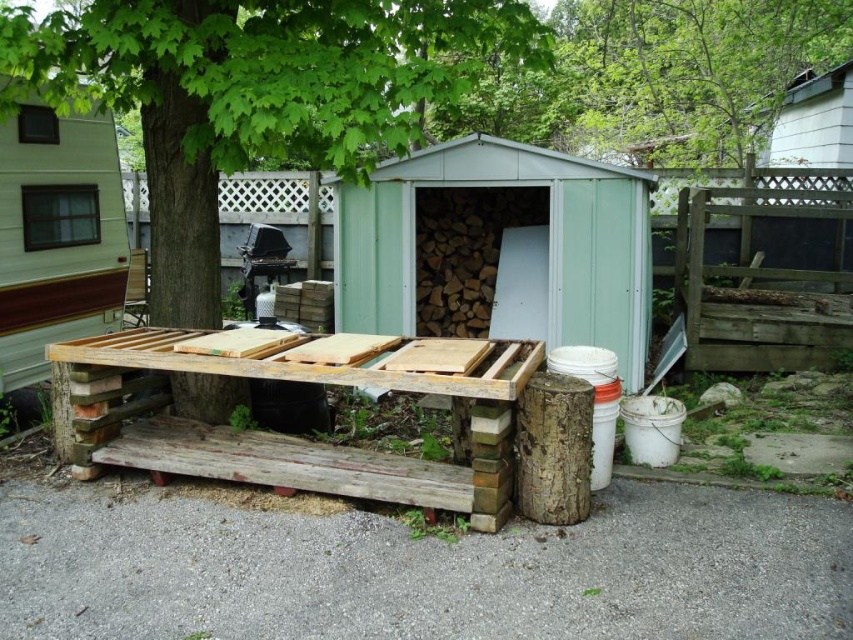
Question: Can you confirm if green leafy tree at center is positioned above weathered wood picnic table at lower left?

Choices:
 (A) no
 (B) yes

Answer: (B)

Question: Is green leafy tree at center further to the viewer compared to green leafy tree at upper center?

Choices:
 (A) no
 (B) yes

Answer: (A)

Question: Observing the image, what is the correct spatial positioning of green leafy tree at center in reference to green leafy tree at upper center?

Choices:
 (A) left
 (B) right

Answer: (A)

Question: Which of the following is the farthest from the observer?

Choices:
 (A) coord(71,90)
 (B) coord(392,337)
 (C) coord(706,131)

Answer: (C)

Question: Among these points, which one is farthest from the camera?

Choices:
 (A) (514, 348)
 (B) (125, 220)

Answer: (B)

Question: Among these objects, which one is farthest from the camera?

Choices:
 (A) green metal shed at center
 (B) green leafy tree at center

Answer: (A)